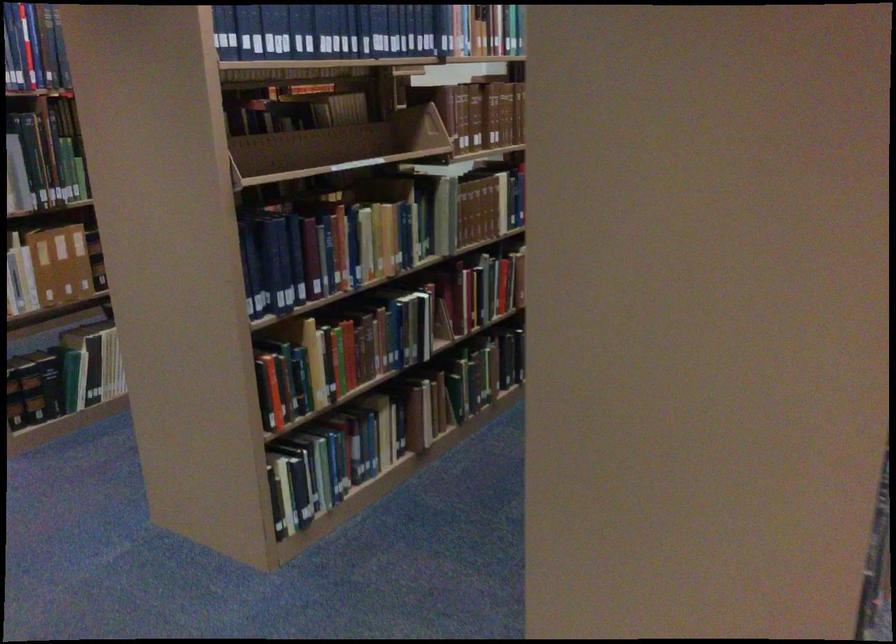
Identify the location of yellow book. (61, 263).